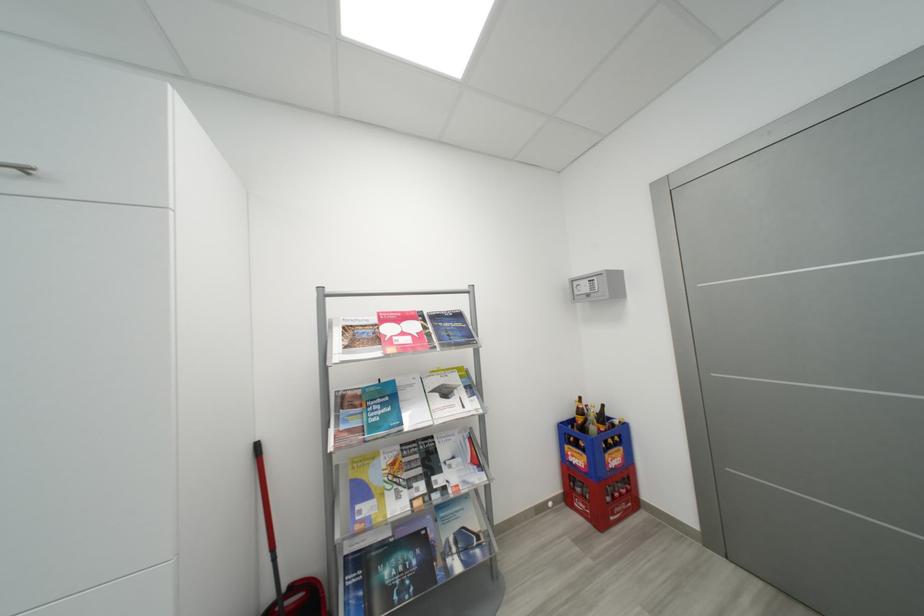
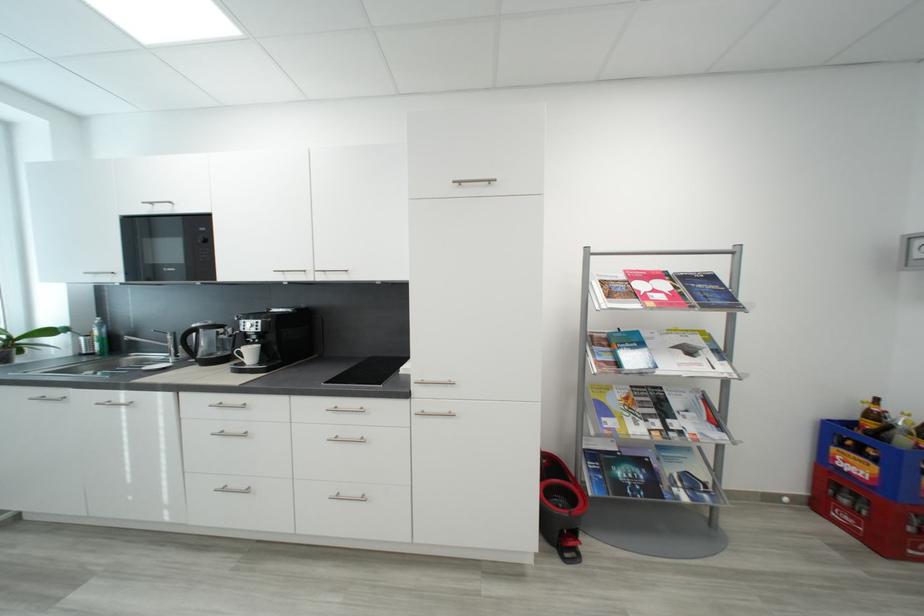
Where in the second image is the point corresponding to (x=465, y=317) from the first image?

(718, 280)